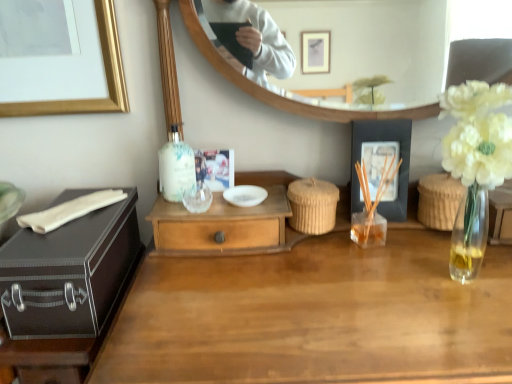
At what (x,y) coordinates should I click in order to perform the action: click on vacant area that lies in front of woven straw picnic basket at center, the second picnic basket from the right. Please return your answer as a coordinate pair (x, y). The image size is (512, 384). Looking at the image, I should click on click(311, 267).